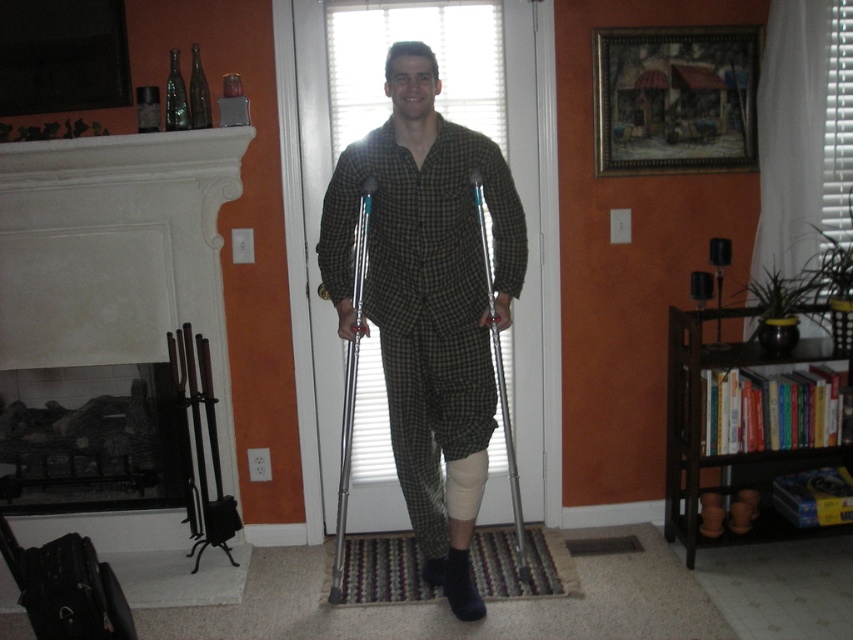
Question: Does metallic silver crutch at center come behind silver metallic crutch at center?

Choices:
 (A) yes
 (B) no

Answer: (A)

Question: Which object appears farthest from the camera in this image?

Choices:
 (A) metallic silver crutch at center
 (B) silver metallic crutch at center

Answer: (A)

Question: Which object is positioned farthest from the matte green pajamas at center?

Choices:
 (A) silver metallic crutch at center
 (B) metallic silver crutch at center

Answer: (B)

Question: Which point is farther to the camera?

Choices:
 (A) matte green pajamas at center
 (B) metallic silver crutch at center
 (C) silver metallic crutch at center

Answer: (B)

Question: Is metallic silver crutch at center thinner than silver metallic crutch at center?

Choices:
 (A) no
 (B) yes

Answer: (B)

Question: From the image, what is the correct spatial relationship of matte green pajamas at center in relation to metallic silver crutch at center?

Choices:
 (A) right
 (B) left

Answer: (A)